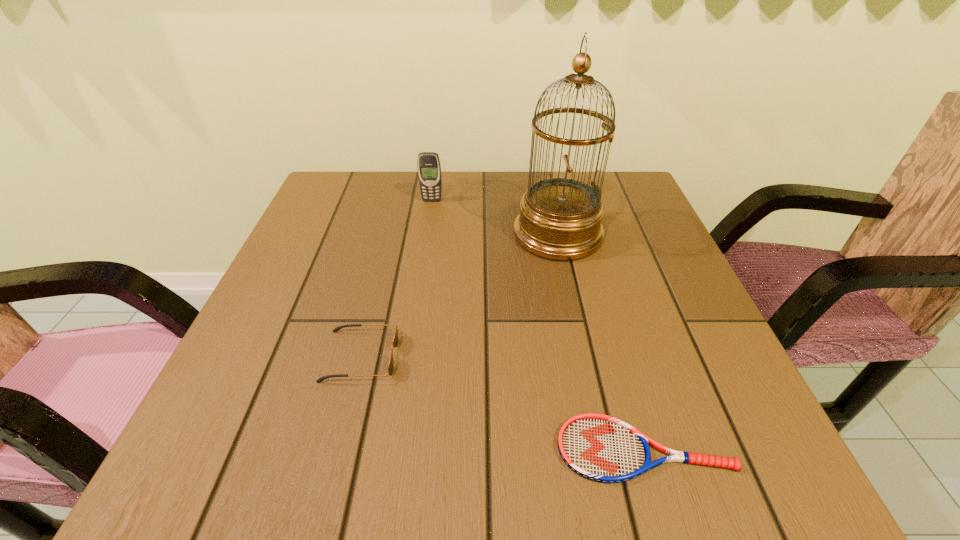
Locate an element on the screen. object that is at the far right corner is located at coordinates (560, 218).

In order to click on object situated at the near right corner in this screenshot , I will do `click(598, 447)`.

Image resolution: width=960 pixels, height=540 pixels. What are the coordinates of `blank area at the far edge` in the screenshot? It's located at (495, 175).

The height and width of the screenshot is (540, 960). Find the location of `blank area at the near edge`. blank area at the near edge is located at coordinates (496, 472).

Image resolution: width=960 pixels, height=540 pixels. I want to click on free spot at the left edge of the desktop, so click(x=291, y=245).

The width and height of the screenshot is (960, 540). I want to click on free space at the right edge of the desktop, so click(x=698, y=347).

Where is `free space at the far left corner of the desktop`? free space at the far left corner of the desktop is located at coordinates coord(376,195).

Identify the location of free space at the far right corner of the desktop. Image resolution: width=960 pixels, height=540 pixels. (607, 217).

Where is `free space at the near right corner`? This screenshot has height=540, width=960. free space at the near right corner is located at coordinates (x=695, y=431).

Identify the location of vacant area that lies between the tallest object and the shortest object. [601, 341].